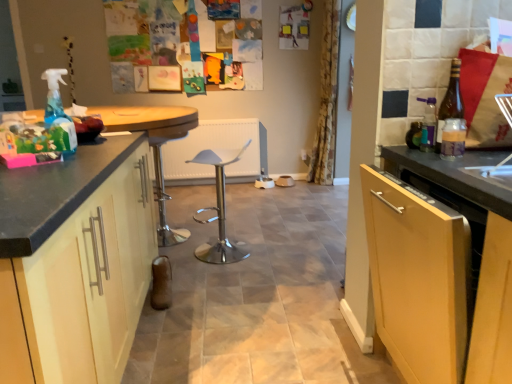
What are the coordinates of `free area below polished silver bar stool at center, acting as the 2th bar stool starting from the left (from a real-world perspective)` in the screenshot? It's located at (227, 256).